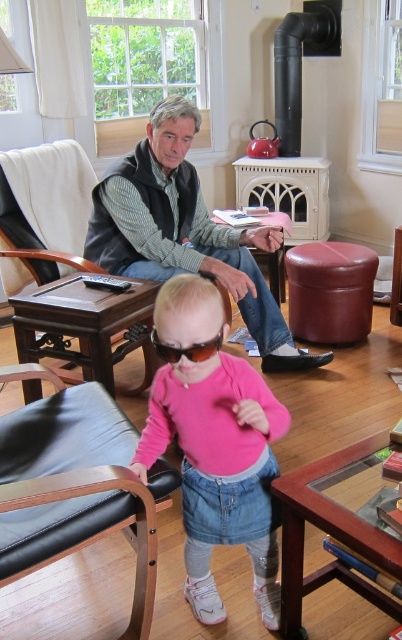
How far apart are black leather armchair at lower left and leather-like stool at center?

5.95 feet

Is black leather armchair at lower left positioned before leather-like stool at center?

That is True.

Is point (112, 440) in front of point (324, 312)?

Yes, it is in front of point (324, 312).

Find the location of a particular element. This screenshot has height=640, width=402. black leather armchair at lower left is located at coordinates (77, 488).

Measure the distance between black leather armchair at lower left and gray vest at center.

A distance of 3.96 feet exists between black leather armchair at lower left and gray vest at center.

Is black leather armchair at lower left bigger than gray vest at center?

No, black leather armchair at lower left is not bigger than gray vest at center.

Does point (73, 536) come behind point (147, 168)?

No, it is not.

The height and width of the screenshot is (640, 402). I want to click on black leather armchair at lower left, so click(77, 488).

Between leather-like stool at center and brown matte sunglasses at center, which one appears on the right side from the viewer's perspective?

leather-like stool at center

Based on the photo, is leather-like stool at center to the right of brown matte sunglasses at center from the viewer's perspective?

Yes, leather-like stool at center is to the right of brown matte sunglasses at center.

Between point (324, 260) and point (184, 349), which one is positioned in front?

Positioned in front is point (184, 349).

What are the coordinates of `leather-like stool at center` in the screenshot? It's located at (330, 291).